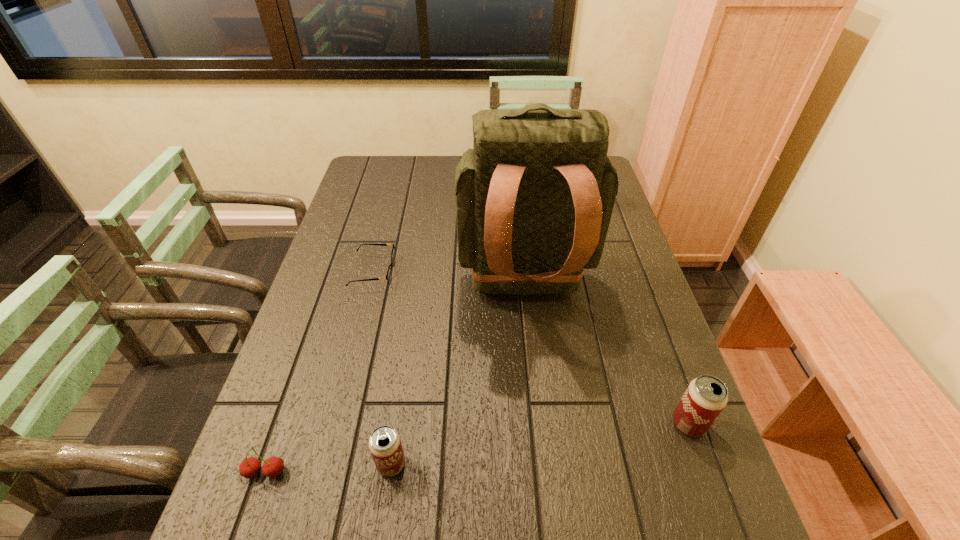
Image resolution: width=960 pixels, height=540 pixels. Identify the location of free space located 0.090m on the front of the right beer can. (711, 485).

In order to click on vacant region located on the front-facing side of the second object from left to right in this screenshot , I will do `click(477, 272)`.

Locate an element on the screen. The image size is (960, 540). vacant point located on the back of the tallest object is located at coordinates (541, 454).

This screenshot has height=540, width=960. In order to click on beer can that is positioned at the near edge in this screenshot , I will do `click(385, 445)`.

You are a GUI agent. You are given a task and a screenshot of the screen. Output one action in this format:
    pyautogui.click(x=<x>, y=<y>)
    Task: Click on the cherry that is positioned at the near edge
    
    Given the screenshot: What is the action you would take?
    pyautogui.click(x=273, y=466)

At what (x,y) coordinates should I click in order to perform the action: click on spectacles positioned at the left edge. Please return your answer as a coordinate pair (x, y). Looking at the image, I should click on (389, 273).

Find the location of a particular element. cherry present at the left edge is located at coordinates (273, 466).

This screenshot has width=960, height=540. I want to click on beer can that is at the right edge, so click(705, 398).

Locate an element on the screen. backpack situated at the right edge is located at coordinates (534, 197).

You are a GUI agent. You are given a task and a screenshot of the screen. Output one action in this format:
    pyautogui.click(x=<x>, y=<y>)
    Task: Click on the object at the near left corner
    
    Given the screenshot: What is the action you would take?
    pyautogui.click(x=273, y=466)